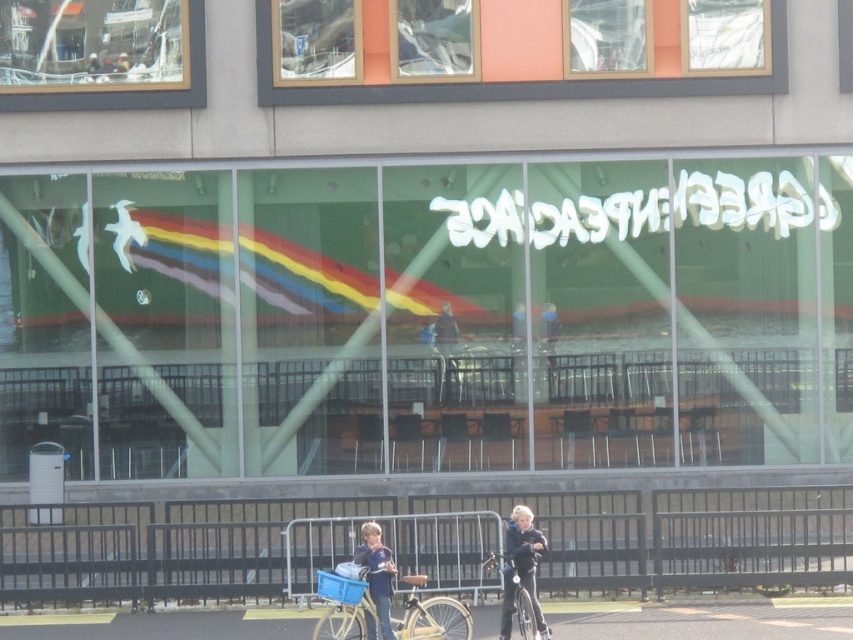
Question: Which of the following is the farthest from the observer?

Choices:
 (A) (518, 592)
 (B) (378, 564)

Answer: (A)

Question: Which of these objects is positioned closest to the matte blue bicycle at center?

Choices:
 (A) green glass shop window at center
 (B) blue denim jeans at lower center
 (C) metallic silver bicycle at center

Answer: (B)

Question: Which object is positioned closest to the matte blue bicycle at center?

Choices:
 (A) green glass shop window at center
 (B) blue denim jeans at lower center

Answer: (B)

Question: Can you confirm if green glass shop window at center is positioned to the left of matte blue bicycle at center?

Choices:
 (A) yes
 (B) no

Answer: (B)

Question: Can you confirm if green glass shop window at center is positioned to the left of metallic silver bicycle at center?

Choices:
 (A) no
 (B) yes

Answer: (A)

Question: Is green glass shop window at center wider than metallic silver bicycle at center?

Choices:
 (A) yes
 (B) no

Answer: (A)